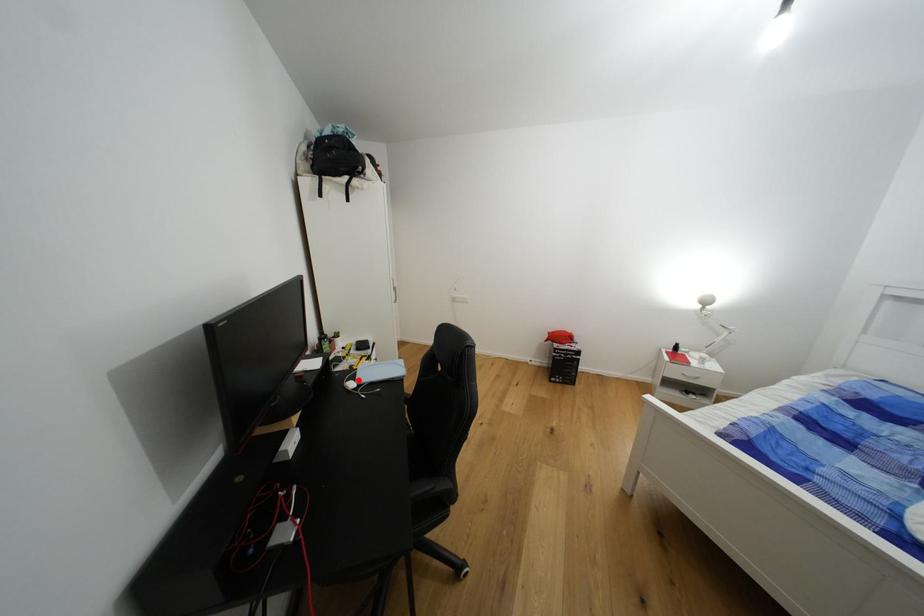
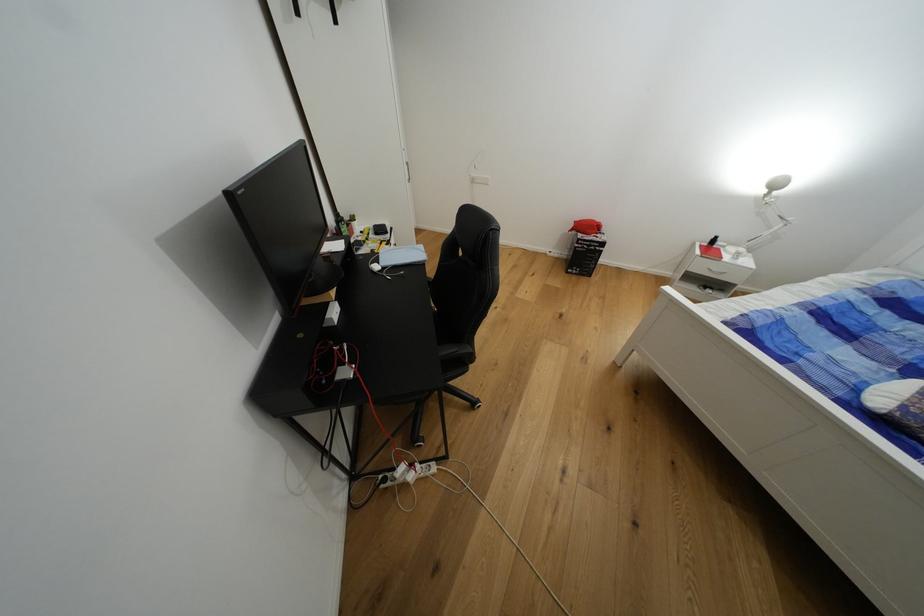
Question: I am providing you with two images of the same scene from different viewpoints. Given a red point in image1, look at the same physical point in image2. Is it:

Choices:
 (A) Closer to the viewpoint
 (B) Farther from the viewpoint

Answer: (B)